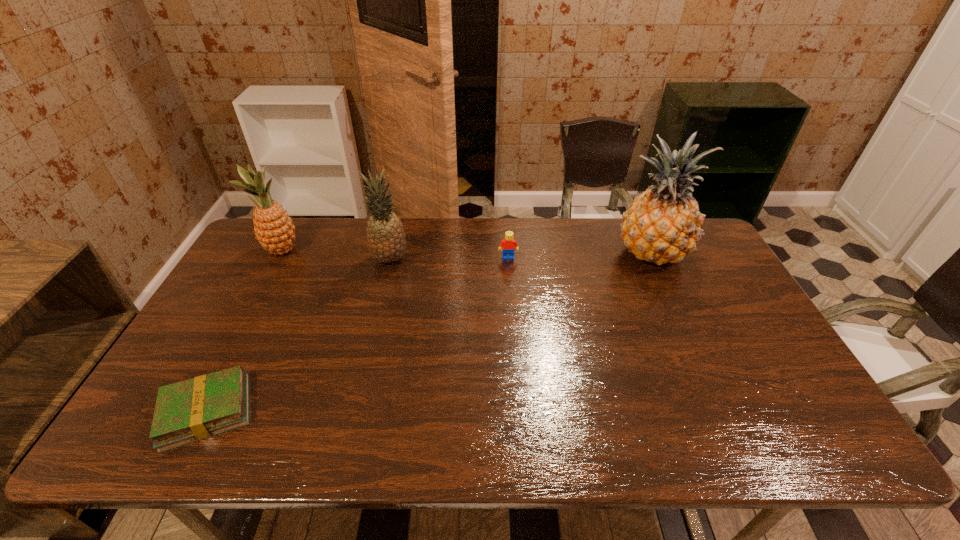
Locate an element on the screen. This screenshot has width=960, height=540. the rightmost object is located at coordinates (663, 224).

Image resolution: width=960 pixels, height=540 pixels. Find the location of `the leftmost pineapple`. the leftmost pineapple is located at coordinates (274, 229).

This screenshot has width=960, height=540. I want to click on the second pineapple from left to right, so click(x=386, y=239).

Where is `Lego`? This screenshot has width=960, height=540. Lego is located at coordinates (508, 243).

Locate an element on the screen. the fourth object from left to right is located at coordinates (508, 243).

Find the location of `the shortest object`. the shortest object is located at coordinates (195, 409).

What are the coordinates of `the nearest object` in the screenshot? It's located at (195, 409).

Where is `vacant space situated on the front of the rightmost pineapple`? The width and height of the screenshot is (960, 540). vacant space situated on the front of the rightmost pineapple is located at coordinates (679, 314).

The image size is (960, 540). I want to click on free spot located 0.130m on the front of the leftmost pineapple, so [261, 289].

Where is `free space located 0.170m on the back of the third object from left to right`? The width and height of the screenshot is (960, 540). free space located 0.170m on the back of the third object from left to right is located at coordinates [399, 219].